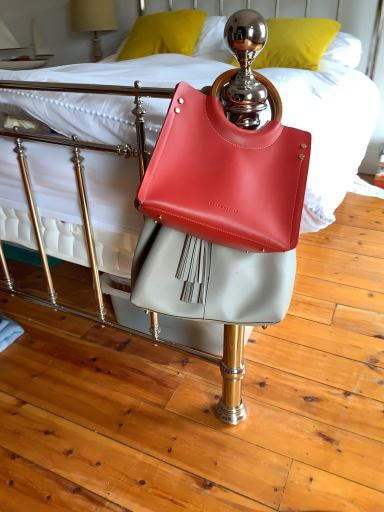
Describe the element at coordinates (164, 34) in the screenshot. The height and width of the screenshot is (512, 384). I see `matte yellow pillow at upper center, which is the first pillow in left-to-right order` at that location.

Find the location of a particular element. This screenshot has height=512, width=384. matte beige lampshade at upper left is located at coordinates (93, 20).

At what (x,y) coordinates should I click in order to perform the action: click on matte leather handbag at center. Please return your answer as a coordinate pair (x, y). The image size is (384, 512). Looking at the image, I should click on (219, 216).

The width and height of the screenshot is (384, 512). Identify the location of metallic gold pillow at upper center, acting as the 1th pillow starting from the right. (296, 42).

Where is `matte yellow pillow at upper center, which is the first pillow in left-to-right order`? The image size is (384, 512). matte yellow pillow at upper center, which is the first pillow in left-to-right order is located at coordinates (164, 34).

Is matte leather handbag at center shorter than metallic gold pillow at upper center, acting as the second pillow starting from the left?

No.

Considering the relative sizes of matte leather handbag at center and metallic gold pillow at upper center, acting as the 1th pillow starting from the right, in the image provided, is matte leather handbag at center thinner than metallic gold pillow at upper center, acting as the 1th pillow starting from the right,?

Indeed, matte leather handbag at center has a lesser width compared to metallic gold pillow at upper center, acting as the 1th pillow starting from the right.

From the image's perspective, which object appears higher, matte leather handbag at center or metallic gold pillow at upper center, acting as the second pillow starting from the left?

metallic gold pillow at upper center, acting as the second pillow starting from the left, from the image's perspective.

From the picture: Could you tell me if matte leather handbag at center is facing metallic gold pillow at upper center, acting as the second pillow starting from the left?

No.

Is matte beige lampshade at upper left positioned far away from metallic gold pillow at upper center, acting as the second pillow starting from the left?

Indeed, matte beige lampshade at upper left is not near metallic gold pillow at upper center, acting as the second pillow starting from the left.

The width and height of the screenshot is (384, 512). What are the coordinates of `table lamp above the metallic gold pillow at upper center, acting as the 1th pillow starting from the right (from the image's perspective)` in the screenshot? It's located at (93, 20).

Is matte beige lampshade at upper left completely or partially outside of metallic gold pillow at upper center, acting as the 1th pillow starting from the right?

Yes, matte beige lampshade at upper left is not within metallic gold pillow at upper center, acting as the 1th pillow starting from the right.

Could you measure the distance between matte beige lampshade at upper left and metallic gold pillow at upper center, acting as the second pillow starting from the left?

matte beige lampshade at upper left is 1.38 meters away from metallic gold pillow at upper center, acting as the second pillow starting from the left.

Would you say matte leather handbag at center is a long distance from matte yellow pillow at upper center, which is counted as the second pillow, starting from the right?

Yes, matte leather handbag at center and matte yellow pillow at upper center, which is counted as the second pillow, starting from the right, are located far from each other.

From the image's perspective, between matte leather handbag at center and matte yellow pillow at upper center, which is counted as the second pillow, starting from the right, which one is located above?

From the image's view, matte yellow pillow at upper center, which is counted as the second pillow, starting from the right, is above.

Does matte leather handbag at center contain matte yellow pillow at upper center, which is the first pillow in left-to-right order?

No, matte yellow pillow at upper center, which is the first pillow in left-to-right order, is not surrounded by matte leather handbag at center.

Looking at this image, considering the positions of objects matte leather handbag at center and matte yellow pillow at upper center, which is counted as the second pillow, starting from the right, in the image provided, who is behind, matte leather handbag at center or matte yellow pillow at upper center, which is counted as the second pillow, starting from the right,?

matte yellow pillow at upper center, which is counted as the second pillow, starting from the right, is behind.

How different are the orientations of metallic gold pillow at upper center, acting as the second pillow starting from the left, and matte yellow pillow at upper center, which is the first pillow in left-to-right order, in degrees?

The facing directions of metallic gold pillow at upper center, acting as the second pillow starting from the left, and matte yellow pillow at upper center, which is the first pillow in left-to-right order, are 10.8 degrees apart.

Considering the sizes of objects metallic gold pillow at upper center, acting as the second pillow starting from the left, and matte yellow pillow at upper center, which is the first pillow in left-to-right order, in the image provided, who is taller, metallic gold pillow at upper center, acting as the second pillow starting from the left, or matte yellow pillow at upper center, which is the first pillow in left-to-right order,?

Standing taller between the two is matte yellow pillow at upper center, which is the first pillow in left-to-right order.

Is metallic gold pillow at upper center, acting as the second pillow starting from the left, with matte yellow pillow at upper center, which is counted as the second pillow, starting from the right?

No, metallic gold pillow at upper center, acting as the second pillow starting from the left, is not beside matte yellow pillow at upper center, which is counted as the second pillow, starting from the right.

From the picture: Considering the sizes of objects matte beige lampshade at upper left and matte yellow pillow at upper center, which is the first pillow in left-to-right order, in the image provided, who is shorter, matte beige lampshade at upper left or matte yellow pillow at upper center, which is the first pillow in left-to-right order,?

matte yellow pillow at upper center, which is the first pillow in left-to-right order.

From a real-world perspective, is matte beige lampshade at upper left under matte yellow pillow at upper center, which is the first pillow in left-to-right order?

Indeed, from a real-world perspective, matte beige lampshade at upper left is positioned beneath matte yellow pillow at upper center, which is the first pillow in left-to-right order.

How different are the orientations of matte beige lampshade at upper left and matte yellow pillow at upper center, which is counted as the second pillow, starting from the right, in degrees?

matte beige lampshade at upper left and matte yellow pillow at upper center, which is counted as the second pillow, starting from the right, are facing 7.03 degrees away from each other.

Is there a large distance between matte beige lampshade at upper left and matte yellow pillow at upper center, which is the first pillow in left-to-right order?

That's not correct — matte beige lampshade at upper left is a little close to matte yellow pillow at upper center, which is the first pillow in left-to-right order.

From the picture: Who is shorter, metallic gold pillow at upper center, acting as the second pillow starting from the left, or matte beige lampshade at upper left?

metallic gold pillow at upper center, acting as the second pillow starting from the left, is shorter.

Identify the location of table lamp lying above the metallic gold pillow at upper center, acting as the second pillow starting from the left (from the image's perspective). This screenshot has height=512, width=384. (93, 20).

Based on the photo, is metallic gold pillow at upper center, acting as the second pillow starting from the left, looking in the opposite direction of matte beige lampshade at upper left?

No, matte beige lampshade at upper left is not at the back of metallic gold pillow at upper center, acting as the second pillow starting from the left.

Is matte leather handbag at center surrounding matte beige lampshade at upper left?

No, matte leather handbag at center does not contain matte beige lampshade at upper left.

Is matte leather handbag at center taller than matte beige lampshade at upper left?

No, matte leather handbag at center is not taller than matte beige lampshade at upper left.

Is matte leather handbag at center at the left side of matte beige lampshade at upper left?

No.

From a real-world perspective, which object stands above the other?

matte beige lampshade at upper left.

From the matte leather handbag at center, count 1st pillows backward and point to it. Please provide its 2D coordinates.

[(296, 42)]

At what (x,y) coordinates should I click in order to perform the action: click on the 2nd pillow below the matte beige lampshade at upper left (from the image's perspective). Please return your answer as a coordinate pair (x, y). This screenshot has width=384, height=512. Looking at the image, I should click on (296, 42).

When comparing their distances from matte leather handbag at center, does matte yellow pillow at upper center, which is counted as the second pillow, starting from the right, or matte beige lampshade at upper left seem closer?

Based on the image, matte yellow pillow at upper center, which is counted as the second pillow, starting from the right, appears to be nearer to matte leather handbag at center.

Considering their positions, is matte yellow pillow at upper center, which is counted as the second pillow, starting from the right, positioned closer to matte beige lampshade at upper left than matte leather handbag at center?

The object closer to matte beige lampshade at upper left is matte yellow pillow at upper center, which is counted as the second pillow, starting from the right.

Which object lies nearer to the anchor point metallic gold pillow at upper center, acting as the second pillow starting from the left, matte yellow pillow at upper center, which is counted as the second pillow, starting from the right, or matte beige lampshade at upper left?

Based on the image, matte yellow pillow at upper center, which is counted as the second pillow, starting from the right, appears to be nearer to metallic gold pillow at upper center, acting as the second pillow starting from the left.

Which object lies nearer to the anchor point matte leather handbag at center, metallic gold pillow at upper center, acting as the 1th pillow starting from the right, or matte yellow pillow at upper center, which is the first pillow in left-to-right order?

Among the two, metallic gold pillow at upper center, acting as the 1th pillow starting from the right, is located nearer to matte leather handbag at center.

When comparing their distances from matte yellow pillow at upper center, which is the first pillow in left-to-right order, does matte beige lampshade at upper left or metallic gold pillow at upper center, acting as the second pillow starting from the left, seem closer?

Based on the image, metallic gold pillow at upper center, acting as the second pillow starting from the left, appears to be nearer to matte yellow pillow at upper center, which is the first pillow in left-to-right order.

When comparing their distances from matte yellow pillow at upper center, which is the first pillow in left-to-right order, does matte leather handbag at center or matte beige lampshade at upper left seem closer?

matte beige lampshade at upper left.

Estimate the real-world distances between objects in this image. Which object is further from metallic gold pillow at upper center, acting as the 1th pillow starting from the right, matte beige lampshade at upper left or matte yellow pillow at upper center, which is the first pillow in left-to-right order?

Among the two, matte beige lampshade at upper left is located further to metallic gold pillow at upper center, acting as the 1th pillow starting from the right.

Considering their positions, is matte leather handbag at center positioned closer to matte yellow pillow at upper center, which is the first pillow in left-to-right order, than metallic gold pillow at upper center, acting as the 1th pillow starting from the right?

metallic gold pillow at upper center, acting as the 1th pillow starting from the right, lies closer to matte yellow pillow at upper center, which is the first pillow in left-to-right order, than the other object.

Locate an element on the screen. pillow between matte beige lampshade at upper left and metallic gold pillow at upper center, acting as the 1th pillow starting from the right, in the horizontal direction is located at coordinates 164,34.

Find the location of a particular element. pillow between matte leather handbag at center and matte yellow pillow at upper center, which is the first pillow in left-to-right order, along the z-axis is located at coordinates (296, 42).